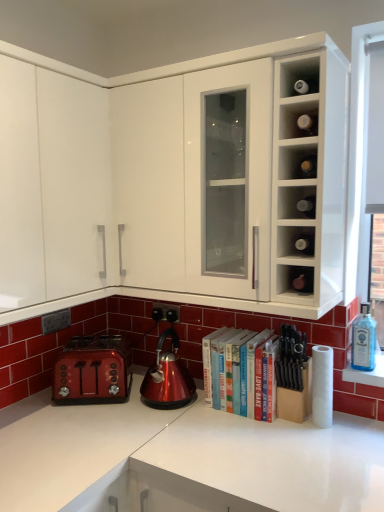
Question: Does point (97, 116) appear closer or farther from the camera than point (155, 315)?

Choices:
 (A) closer
 (B) farther

Answer: (A)

Question: In terms of height, does white glossy cabinet at upper center, the second cabinetry positioned from the left, look taller or shorter compared to black plastic electric outlet at lower center, which ranks as the 1th electric outlet in back-to-front order?

Choices:
 (A) tall
 (B) short

Answer: (A)

Question: Which of these objects is positioned farthest from the matte glass wine bottle at center-right, acting as the 2th cabinet starting from the top?

Choices:
 (A) white glossy cabinet at upper center, the second cabinetry positioned from the left
 (B) blue glass bottle at right
 (C) matte glass wine bottles at upper right, marked as the 3th cabinet in a bottom-to-top arrangement
 (D) black plastic electric outlet at lower center, the second electric outlet in the left-to-right sequence
 (E) white matte paper towel at lower right

Answer: (D)

Question: Which object is positioned closest to the matte black electric outlet at lower left, marked as the 2th electric outlet in a right-to-left arrangement?

Choices:
 (A) matte glass wine bottles at upper right, marked as the 3th cabinet in a bottom-to-top arrangement
 (B) white matte cabinet at upper left, which is the 2th cabinetry from right to left
 (C) blue glass bottle at right
 (D) black plastic electric outlet at lower center, which ranks as the 1th electric outlet in back-to-front order
 (E) white glossy cabinet at upper center, the 1th cabinetry when ordered from right to left

Answer: (D)